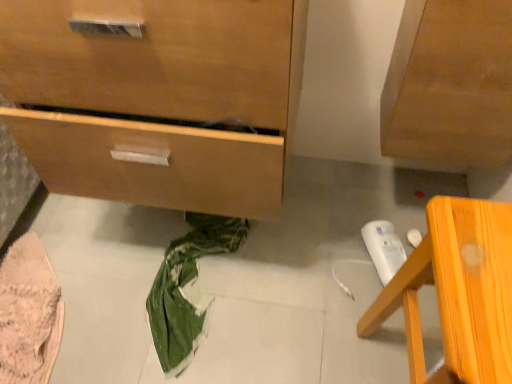
Measure the distance between point (468,199) and camera.

Point (468,199) and camera are 1.28 meters apart.

In order to face pink knitted fabric at lower left, should I rotate leftwards or rightwards?

A 26.983 degree turn to the left will do.

Find the location of `orange wood chair at lower right`. orange wood chair at lower right is located at coordinates (457, 292).

Who is smaller, pink knitted fabric at lower left or wooden chest of drawers at lower left?

With smaller size is pink knitted fabric at lower left.

Is pink knitted fabric at lower left taller or shorter than wooden chest of drawers at lower left?

In the image, pink knitted fabric at lower left appears to be shorter than wooden chest of drawers at lower left.

Is pink knitted fabric at lower left far away from wooden chest of drawers at lower left?

pink knitted fabric at lower left is actually quite close to wooden chest of drawers at lower left.

Considering the points (12, 264) and (149, 80), which point is in front, point (12, 264) or point (149, 80)?

Point (149, 80)

Considering the relative sizes of wooden chest of drawers at lower left and orange wood chair at lower right in the image provided, is wooden chest of drawers at lower left thinner than orange wood chair at lower right?

In fact, wooden chest of drawers at lower left might be wider than orange wood chair at lower right.

Which is correct: wooden chest of drawers at lower left is inside orange wood chair at lower right, or outside of it?

wooden chest of drawers at lower left is not inside orange wood chair at lower right, it's outside.

Does point (31, 12) lie behind point (447, 232)?

Yes, point (31, 12) is farther from viewer.

Which is more to the right, wooden chest of drawers at lower left or orange wood chair at lower right?

Positioned to the right is orange wood chair at lower right.

Image resolution: width=512 pixels, height=384 pixels. I want to click on chest of drawers on the left of the orange wood chair at lower right, so click(157, 99).

Is orange wood chair at lower right far from wooden chest of drawers at lower left?

No, there isn't a large distance between orange wood chair at lower right and wooden chest of drawers at lower left.

How many degrees apart are the facing directions of orange wood chair at lower right and wooden chest of drawers at lower left?

89.1 degrees.

Considering the relative positions of orange wood chair at lower right and wooden chest of drawers at lower left in the image provided, is orange wood chair at lower right to the left of wooden chest of drawers at lower left from the viewer's perspective?

In fact, orange wood chair at lower right is to the right of wooden chest of drawers at lower left.

Is point (21, 334) closer or farther from the camera than point (380, 309)?

Point (21, 334) is positioned farther from the camera compared to point (380, 309).

Which of these two, pink knitted fabric at lower left or orange wood chair at lower right, stands taller?

With more height is orange wood chair at lower right.

Is pink knitted fabric at lower left touching orange wood chair at lower right?

pink knitted fabric at lower left and orange wood chair at lower right are clearly separated.

Could you tell me if wooden chest of drawers at lower left is facing pink knitted fabric at lower left?

No.

Which object is thinner, wooden chest of drawers at lower left or pink knitted fabric at lower left?

Thinner between the two is pink knitted fabric at lower left.

Between point (249, 97) and point (23, 337), which one is positioned in front?

The point (249, 97) is closer.

How much distance is there between wooden chest of drawers at lower left and pink knitted fabric at lower left?

wooden chest of drawers at lower left is 22.52 inches away from pink knitted fabric at lower left.

How much distance is there between orange wood chair at lower right and pink knitted fabric at lower left?

orange wood chair at lower right is 36.37 inches from pink knitted fabric at lower left.

Is orange wood chair at lower right positioned behind pink knitted fabric at lower left?

No, the depth of orange wood chair at lower right is less than that of pink knitted fabric at lower left.

Who is smaller, orange wood chair at lower right or pink knitted fabric at lower left?

With smaller size is pink knitted fabric at lower left.

Is orange wood chair at lower right not within pink knitted fabric at lower left?

orange wood chair at lower right is positioned outside pink knitted fabric at lower left.

Where is `material behind the wooden chest of drawers at lower left`? This screenshot has height=384, width=512. material behind the wooden chest of drawers at lower left is located at coordinates (29, 313).

Where is `furniture on the right side of wooden chest of drawers at lower left`? This screenshot has width=512, height=384. furniture on the right side of wooden chest of drawers at lower left is located at coordinates (457, 292).

When comparing their distances from wooden chest of drawers at lower left, does orange wood chair at lower right or pink knitted fabric at lower left seem closer?

orange wood chair at lower right.

Estimate the real-world distances between objects in this image. Which object is further from pink knitted fabric at lower left, wooden chest of drawers at lower left or orange wood chair at lower right?

Among the two, orange wood chair at lower right is located further to pink knitted fabric at lower left.

Considering their positions, is pink knitted fabric at lower left positioned further to orange wood chair at lower right than wooden chest of drawers at lower left?

Based on the image, pink knitted fabric at lower left appears to be further to orange wood chair at lower right.

From the image, which object appears to be farther from wooden chest of drawers at lower left, pink knitted fabric at lower left or orange wood chair at lower right?

pink knitted fabric at lower left lies further to wooden chest of drawers at lower left than the other object.

Considering their positions, is orange wood chair at lower right positioned closer to pink knitted fabric at lower left than wooden chest of drawers at lower left?

Among the two, wooden chest of drawers at lower left is located nearer to pink knitted fabric at lower left.

Looking at the image, which one is located closer to orange wood chair at lower right, wooden chest of drawers at lower left or pink knitted fabric at lower left?

wooden chest of drawers at lower left.

This screenshot has height=384, width=512. In order to click on chest of drawers between pink knitted fabric at lower left and orange wood chair at lower right in this screenshot , I will do `click(157, 99)`.